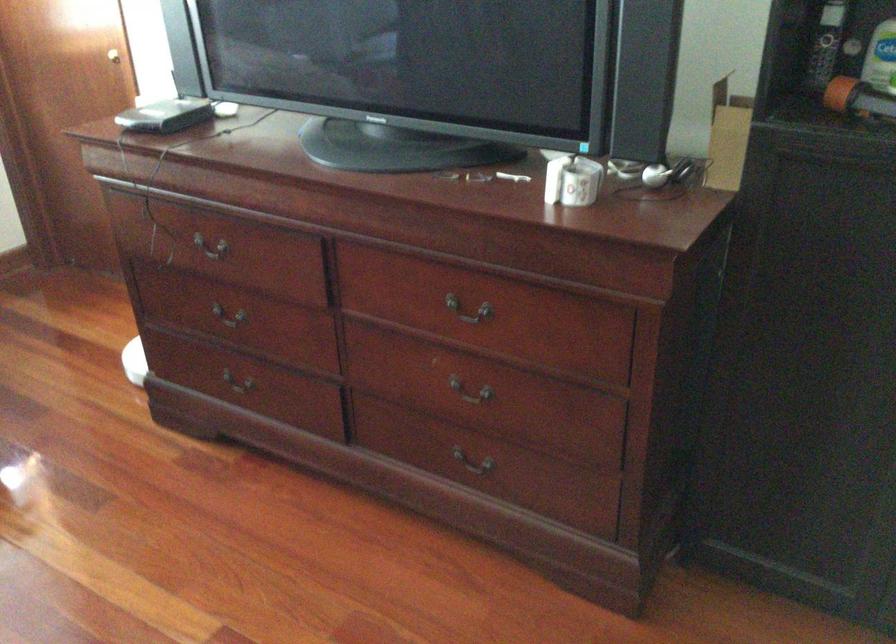
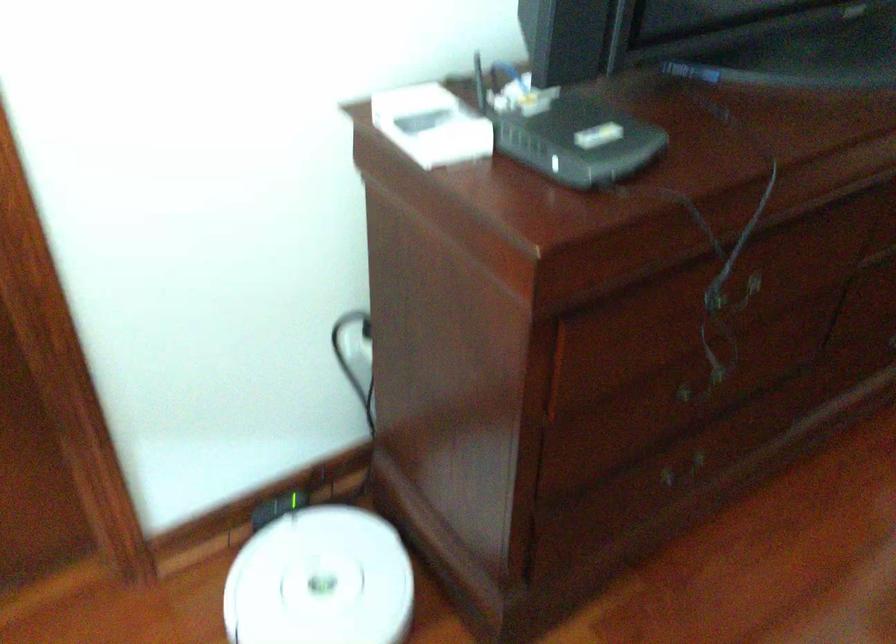
Where in the second image is the point corresponding to pixel 148 102 from the first image?

(431, 125)